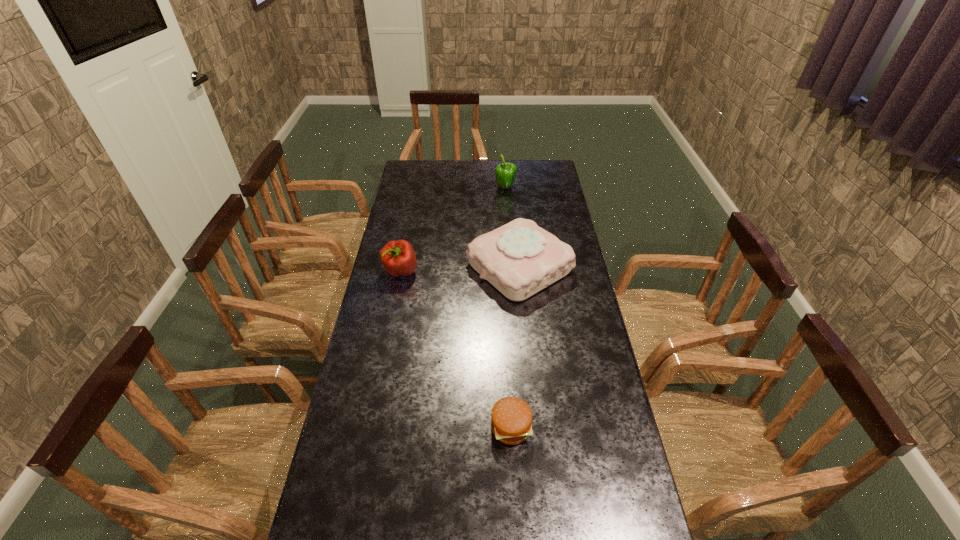
The width and height of the screenshot is (960, 540). What are the coordinates of `the farther bell pepper` in the screenshot? It's located at (505, 172).

Where is `the right bell pepper`? Image resolution: width=960 pixels, height=540 pixels. the right bell pepper is located at coordinates [505, 172].

The height and width of the screenshot is (540, 960). Find the location of `cake`. cake is located at coordinates (519, 259).

You are a GUI agent. You are given a task and a screenshot of the screen. Output one action in this format:
    pyautogui.click(x=<x>, y=<y>)
    Task: Click on the leftmost object
    The width and height of the screenshot is (960, 540).
    Given the screenshot: What is the action you would take?
    pyautogui.click(x=398, y=257)

Locate an element on the screen. the shorter bell pepper is located at coordinates (398, 257).

This screenshot has height=540, width=960. Find the location of `hamburger`. hamburger is located at coordinates [x=511, y=417].

This screenshot has height=540, width=960. In order to click on the nearest object in this screenshot , I will do `click(511, 417)`.

Locate an element on the screen. free region located 0.220m on the front of the taller bell pepper is located at coordinates (508, 221).

Image resolution: width=960 pixels, height=540 pixels. Identify the location of vacant area situated 0.380m on the front of the cake. (533, 400).

Where is `vacant region located 0.300m on the right of the nearer bell pepper`? Image resolution: width=960 pixels, height=540 pixels. vacant region located 0.300m on the right of the nearer bell pepper is located at coordinates (497, 272).